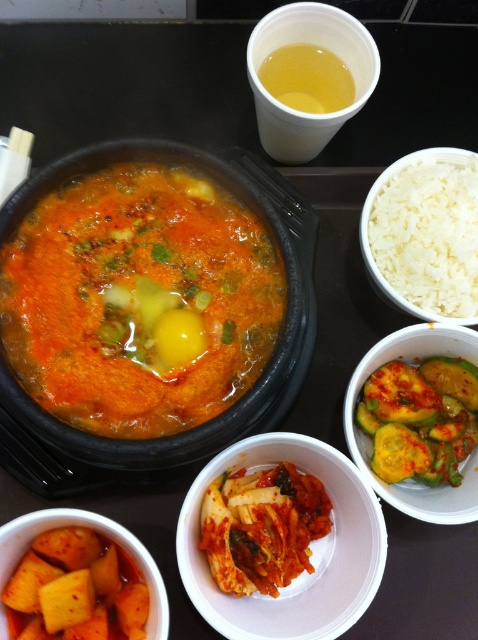
You are a food critic who just arrived at the table. You want to taste the bright red kimchi at center and the green pickled cucumber at lower right first. Which one is closer to you?

The bright red kimchi at center is closer to you because it is in front of the green pickled cucumber at lower right.

You are a food critic evaluating the height of the dishes on the dark tray. Which of the two side dishes, the bright red kimchi at center or the green pickled cucumber at lower right, is taller?

The green pickled cucumber at lower right is taller than the bright red kimchi at center.